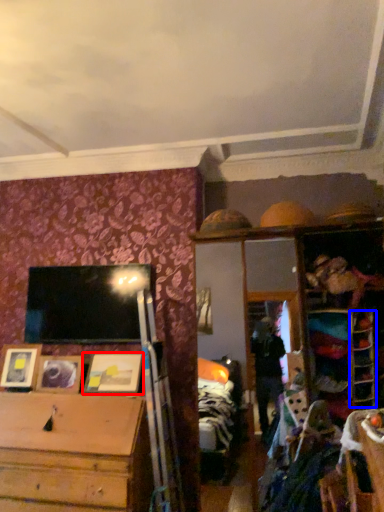
Question: Among these objects, which one is nearest to the camera, picture frame (highlighted by a red box) or shelf (highlighted by a blue box)?

Choices:
 (A) picture frame
 (B) shelf

Answer: (B)